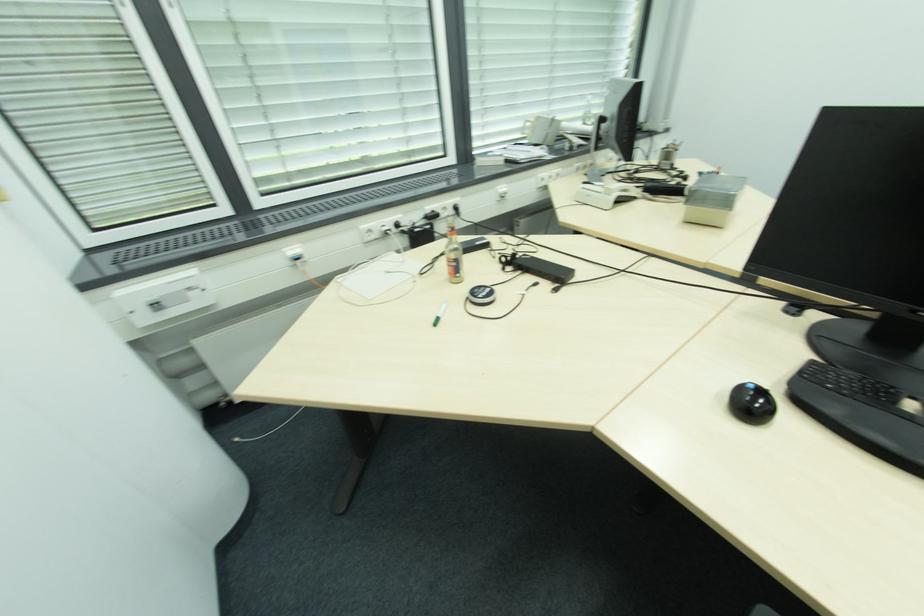
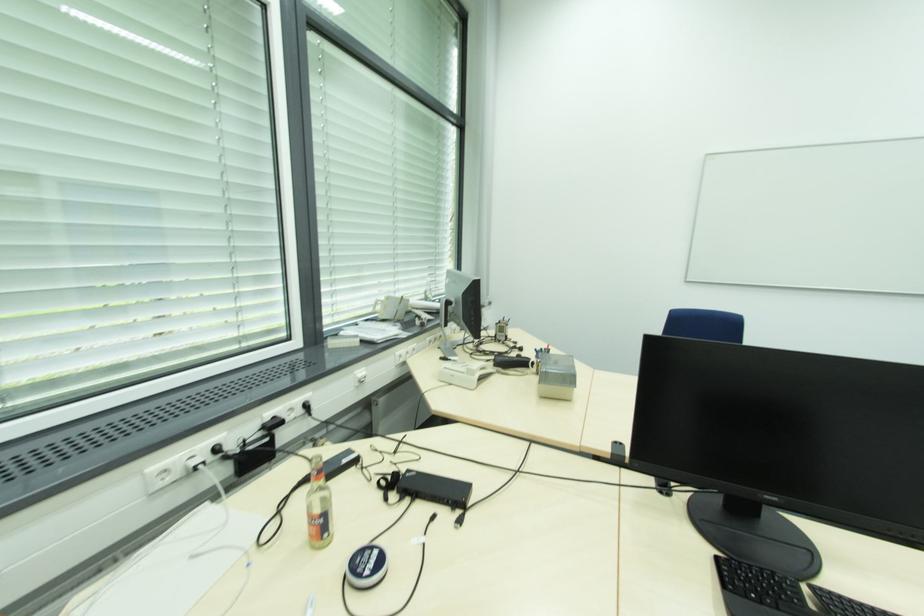
Where in the second image is the point corresponding to pixel 447 209 from the first image?

(294, 410)